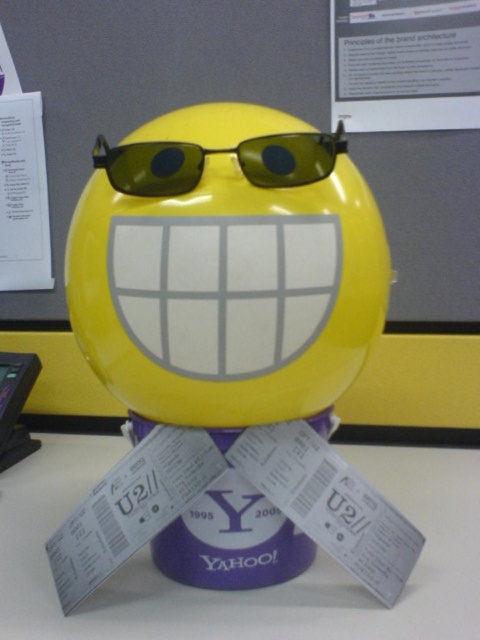
Does yellow glossy ball at center appear on the right side of purple matte/yellow plastic at center?

Yes, yellow glossy ball at center is to the right of purple matte/yellow plastic at center.

Is point (225, 534) behind point (278, 628)?

Yes.

This screenshot has height=640, width=480. What are the coordinates of `yellow glossy ball at center` in the screenshot? It's located at (227, 269).

Consider the image. Is yellow glossy ball at center wider than black plastic phone at lower left?

Yes, yellow glossy ball at center is wider than black plastic phone at lower left.

Is yellow glossy ball at center to the right of black plastic phone at lower left from the viewer's perspective?

Correct, you'll find yellow glossy ball at center to the right of black plastic phone at lower left.

Which is behind, point (280, 266) or point (15, 458)?

The point (15, 458) is more distant.

I want to click on yellow glossy ball at center, so click(x=227, y=269).

Is yellow glossy ball at center further to the viewer compared to green plastic sunglasses at center?

No, it is in front of green plastic sunglasses at center.

Is point (199, 131) farther from viewer compared to point (158, 157)?

Yes.

Who is more forward, [300,268] or [180,172]?

Positioned in front is point [300,268].

I want to click on yellow glossy ball at center, so click(x=227, y=269).